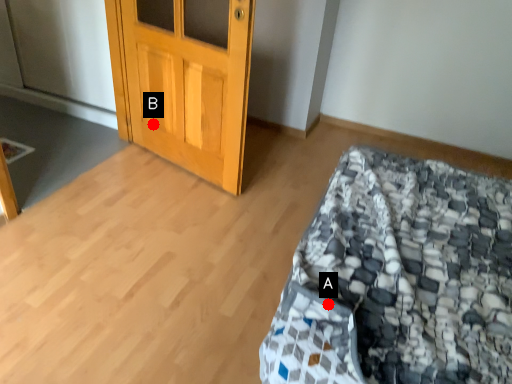
Question: Two points are circled on the image, labeled by A and B beside each circle. Which of the following is the farthest from the observer?

Choices:
 (A) A is further
 (B) B is further

Answer: (B)